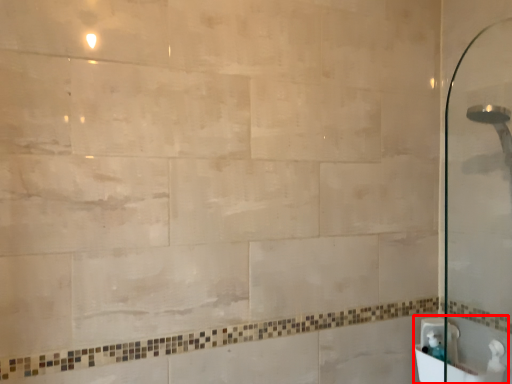
Question: Considering the relative positions of sink (annotated by the red box) and sink in the image provided, where is sink (annotated by the red box) located with respect to the staircase?

Choices:
 (A) right
 (B) left

Answer: (A)